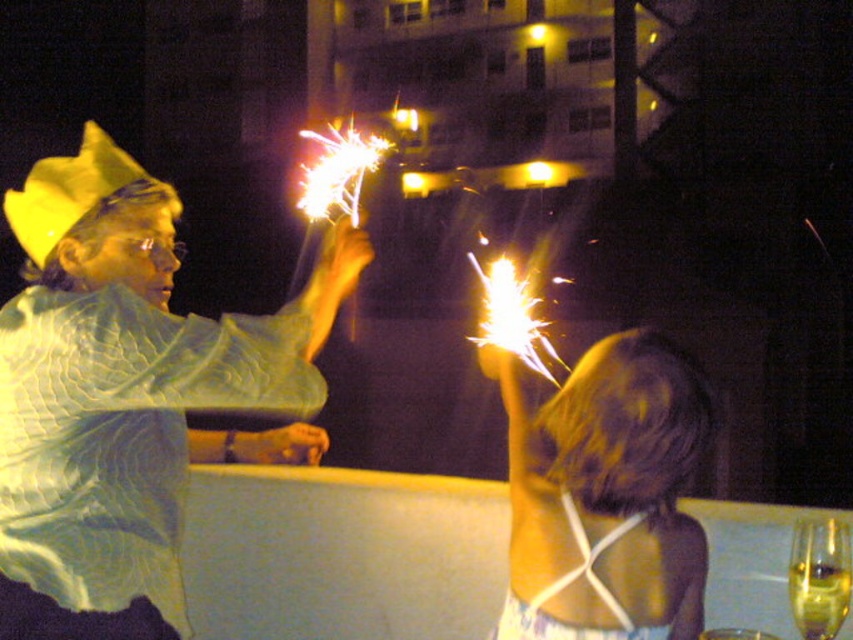
You are standing at the camera position and want to throw a small ball to the point marked as point [264,346]. Can you estimate if the ball will reach the point if you throw it with a force that can cover 1.7 meters?

The point [264,346] is 1.67 meters away from the camera. Since the ball can travel 1.7 meters, it should reach the point.

Based on the photo, you are standing on the balcony and need to place a small potted plant. The plant must be placed between the matte green fabric at left and the railing. Given that the railing is at point 0.0, can you determine where to place the plant?

The matte green fabric at left is located at point 0.597, so the plant should be placed between 0.0 and 0.597 along the horizontal axis.

You are standing on the balcony and want to hand a sparkler to the person at the right. The point where you should aim to hand it is at point (132,381). What object is located at that point?

The point (132,381) indicates the matte green fabric at left.